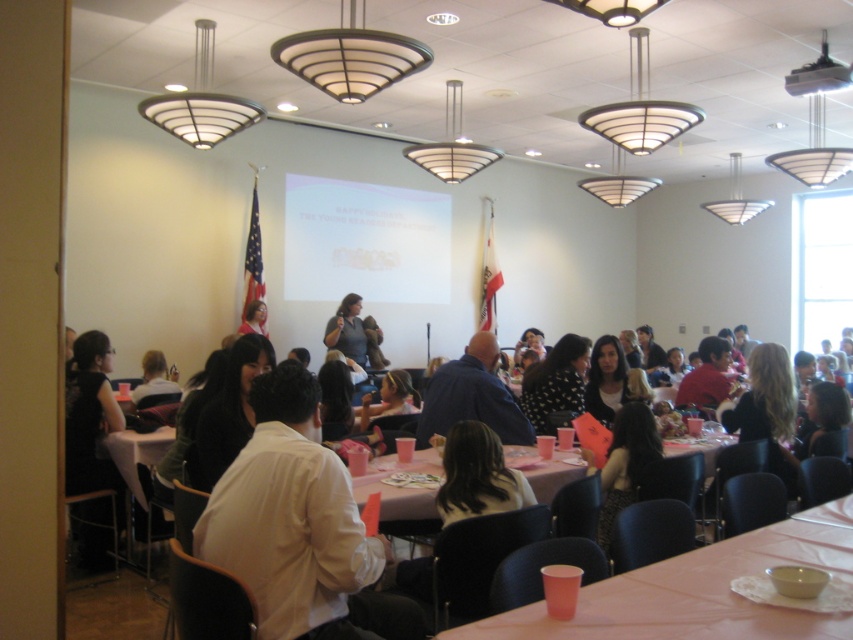
Question: Which object appears farthest from the camera in this image?

Choices:
 (A) matte gray sweater at center
 (B) white matte shirt at center

Answer: (A)

Question: Which point is closer to the camera?

Choices:
 (A) (345, 339)
 (B) (456, 400)
 (C) (807, 90)
 (D) (386, 461)

Answer: (D)

Question: Does white matte projection screen at upper center have a greater width compared to blue shirt at center?

Choices:
 (A) no
 (B) yes

Answer: (B)

Question: Is pink plastic cup at lower center above blue shirt at center?

Choices:
 (A) no
 (B) yes

Answer: (A)

Question: Is pink plastic cup at lower center to the right of metallic projector at upper center from the viewer's perspective?

Choices:
 (A) yes
 (B) no

Answer: (B)

Question: Considering the real-world distances, which object is closest to the pink plastic cup at lower center?

Choices:
 (A) matte gray sweater at center
 (B) matte black jacket at center
 (C) blue shirt at center

Answer: (C)